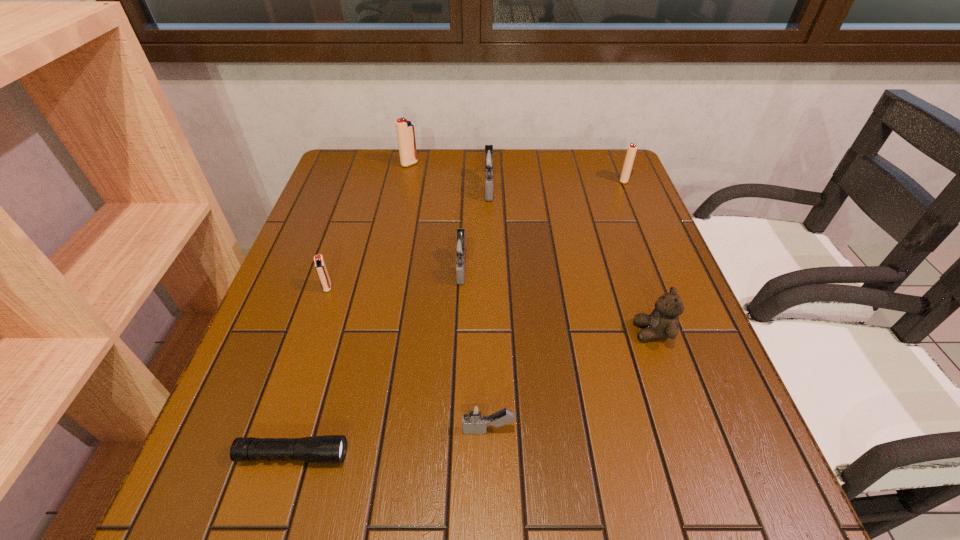
This screenshot has width=960, height=540. I want to click on the nearest gray igniter, so click(x=475, y=417).

I want to click on the nearest igniter, so (475, 417).

What are the coordinates of `black flashlight` in the screenshot? It's located at (330, 449).

At what (x,y) coordinates should I click in order to perform the action: click on flashlight. Please return your answer as a coordinate pair (x, y). The width and height of the screenshot is (960, 540). Looking at the image, I should click on (330, 449).

Locate an element on the screen. The image size is (960, 540). vacant space situated on the front of the fifth igniter from right to left is located at coordinates (396, 230).

At what (x,y) coordinates should I click in order to perform the action: click on vacant space positioned 0.180m on the right of the biggest gray igniter. Please return your answer as a coordinate pair (x, y). This screenshot has height=540, width=960. Looking at the image, I should click on (564, 188).

I want to click on free point located 0.400m on the front of the second farthest gray igniter, so click(453, 463).

Locate an element on the screen. This screenshot has width=960, height=540. free region located 0.050m on the back of the rightmost igniter is located at coordinates (619, 167).

Where is `vacant area situated on the face of the sixth farthest object`? vacant area situated on the face of the sixth farthest object is located at coordinates (444, 332).

Locate an element on the screen. vacant space located 0.290m on the face of the sixth farthest object is located at coordinates [x=492, y=332].